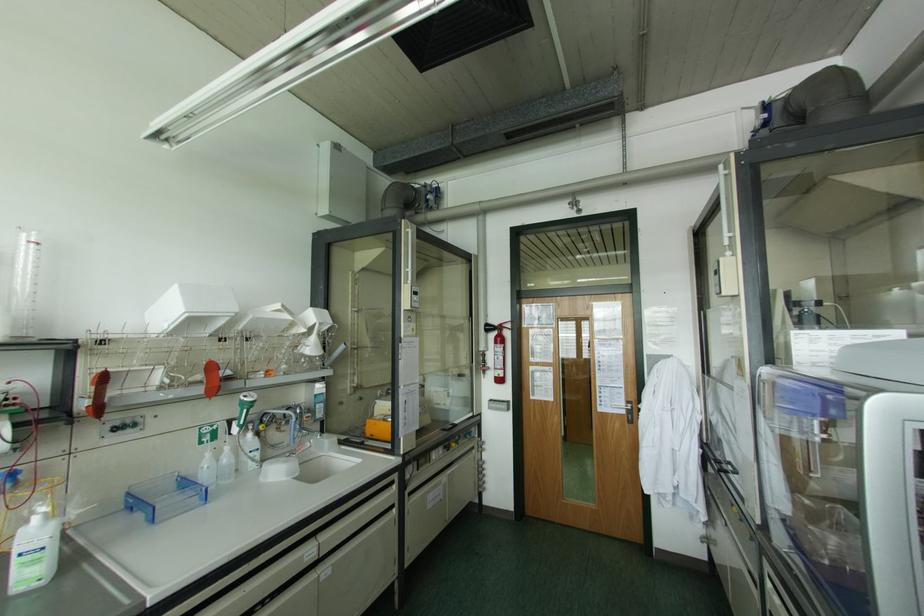
The width and height of the screenshot is (924, 616). What do you see at coordinates (289, 436) in the screenshot?
I see `the metal faucet handle` at bounding box center [289, 436].